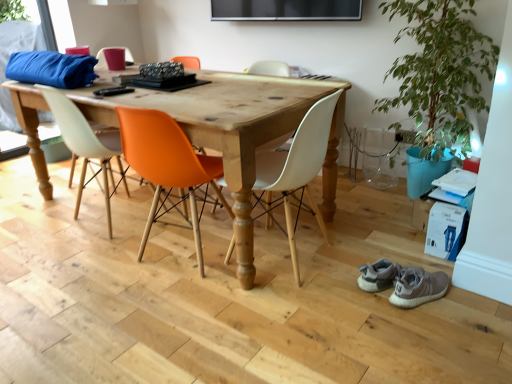
Question: Can you confirm if green leafy plant at right is positioned to the left of wooden table at center?

Choices:
 (A) yes
 (B) no

Answer: (B)

Question: Is green leafy plant at right next to wooden table at center and touching it?

Choices:
 (A) no
 (B) yes

Answer: (A)

Question: Is green leafy plant at right closer to the viewer compared to wooden table at center?

Choices:
 (A) no
 (B) yes

Answer: (A)

Question: From a real-world perspective, is green leafy plant at right positioned under wooden table at center based on gravity?

Choices:
 (A) yes
 (B) no

Answer: (B)

Question: From the image's perspective, is green leafy plant at right beneath wooden table at center?

Choices:
 (A) yes
 (B) no

Answer: (B)

Question: From the image's perspective, is green leafy plant at right above wooden table at center?

Choices:
 (A) yes
 (B) no

Answer: (A)

Question: Is white matte chair at center, arranged as the 1th chair when viewed from the right, bigger than matte orange chair at center, which is the third chair from right to left?

Choices:
 (A) yes
 (B) no

Answer: (B)

Question: Can you confirm if white matte chair at center, arranged as the 1th chair when viewed from the right, is wider than matte orange chair at center, which is the third chair from right to left?

Choices:
 (A) yes
 (B) no

Answer: (B)

Question: From a real-world perspective, is white matte chair at center, arranged as the 1th chair when viewed from the right, over matte orange chair at center, arranged as the second chair when viewed from the left?

Choices:
 (A) yes
 (B) no

Answer: (B)

Question: Is white matte chair at center, arranged as the 1th chair when viewed from the right, positioned before matte orange chair at center, arranged as the second chair when viewed from the left?

Choices:
 (A) no
 (B) yes

Answer: (B)

Question: Is white matte chair at center, acting as the 4th chair starting from the left, looking in the opposite direction of matte orange chair at center, which is the third chair from right to left?

Choices:
 (A) no
 (B) yes

Answer: (A)

Question: Is white matte chair at center, acting as the 4th chair starting from the left, positioned far away from matte orange chair at center, arranged as the second chair when viewed from the left?

Choices:
 (A) yes
 (B) no

Answer: (A)

Question: Is green leafy plant at right further to the viewer compared to white matte chair at center, arranged as the 1th chair when viewed from the right?

Choices:
 (A) no
 (B) yes

Answer: (B)